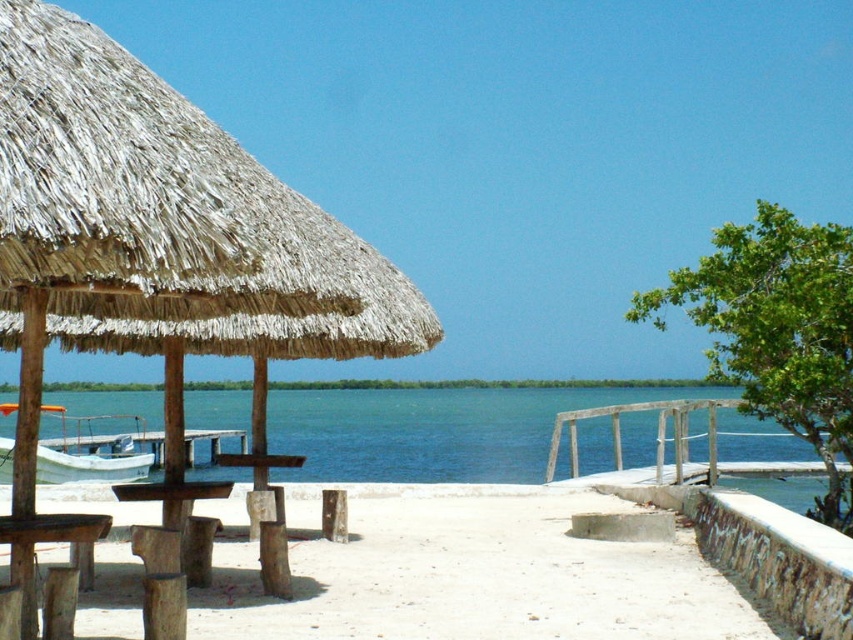
Who is positioned more to the left, thatched straw umbrella at left or white matte boat at lower left?

white matte boat at lower left is more to the left.

Image resolution: width=853 pixels, height=640 pixels. What are the coordinates of `thatched straw umbrella at left` in the screenshot? It's located at (137, 205).

Does thatched straw umbrella at left come in front of blue water at center?

Yes, thatched straw umbrella at left is closer to the viewer.

Is thatched straw umbrella at left taller than blue water at center?

Correct, thatched straw umbrella at left is much taller as blue water at center.

Which is behind, point (96, 230) or point (383, 416)?

Point (383, 416)

This screenshot has width=853, height=640. Find the location of `thatched straw umbrella at left`. thatched straw umbrella at left is located at coordinates (137, 205).

Is point (73, 180) farther from viewer compared to point (677, 634)?

No, it is not.

Identify the location of thatched straw umbrella at left. click(137, 205).

Which is in front, point (314, 264) or point (653, 624)?

Point (314, 264)

Locate an element on the screen. The width and height of the screenshot is (853, 640). thatched straw umbrella at left is located at coordinates (137, 205).